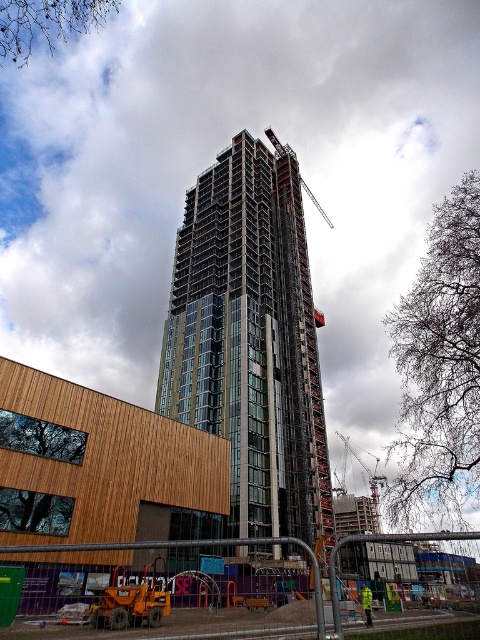
Question: Does metallic gray crane at center appear on the right side of yellow reflective jacket at center?

Choices:
 (A) yes
 (B) no

Answer: (A)

Question: In this image, where is metallic gray crane at center located relative to yellow reflective jacket at center?

Choices:
 (A) above
 (B) below

Answer: (B)

Question: Among these objects, which one is farthest from the camera?

Choices:
 (A) orange construction equipment at lower left
 (B) metallic gray crane at center
 (C) glassy steel building at center

Answer: (B)

Question: Which object is closer to the camera taking this photo?

Choices:
 (A) metallic gray crane at center
 (B) yellow reflective jacket at center
 (C) glassy steel building at center

Answer: (B)

Question: Estimate the real-world distances between objects in this image. Which object is farther from the orange construction equipment at lower left?

Choices:
 (A) glassy steel building at center
 (B) metallic gray crane at center
 (C) yellow reflective jacket at center

Answer: (B)

Question: Does orange construction equipment at lower left have a greater width compared to metallic gray crane at center?

Choices:
 (A) no
 (B) yes

Answer: (B)